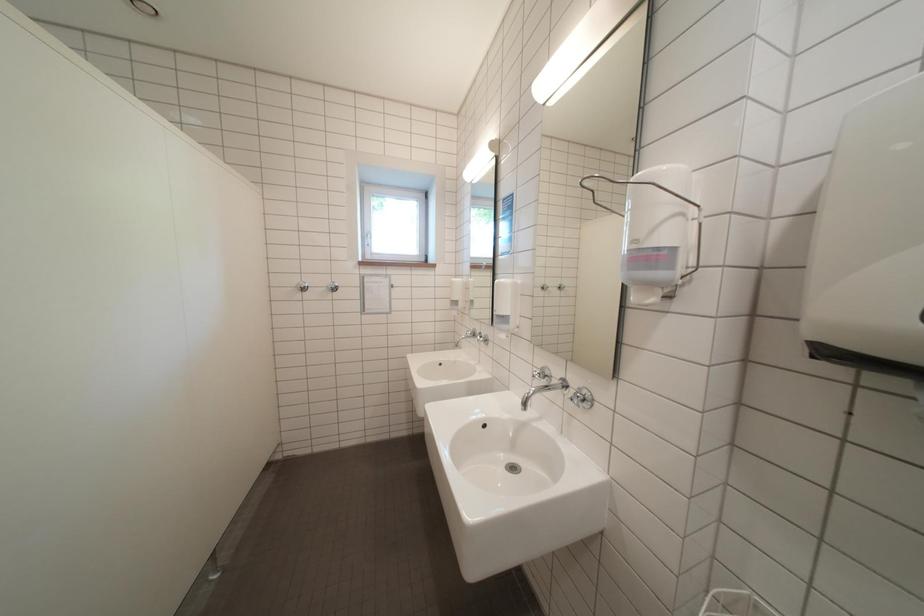
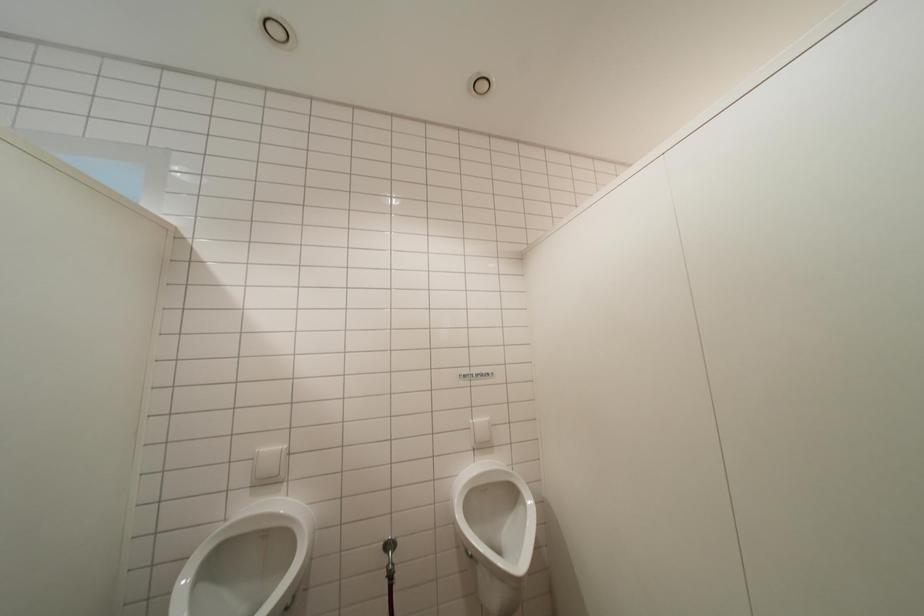
Question: In a continuous first-person perspective shot, in which direction is the camera moving?

Choices:
 (A) Left
 (B) Right
 (C) Forward
 (D) Backward

Answer: (A)